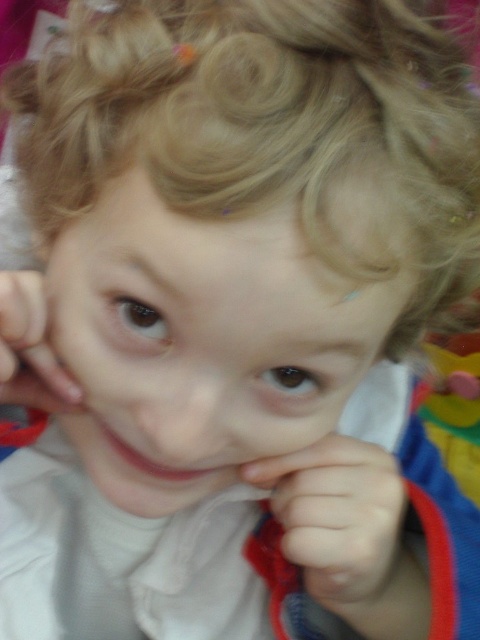
Question: Does smooth skin hand at center have a smaller size compared to smooth skin hand at left?

Choices:
 (A) yes
 (B) no

Answer: (B)

Question: Which object is farther from the camera taking this photo?

Choices:
 (A) smooth skin hand at left
 (B) smooth skin hand at center

Answer: (B)

Question: Can you confirm if smooth skin hand at center is smaller than smooth skin hand at left?

Choices:
 (A) no
 (B) yes

Answer: (A)

Question: Which of the following is the closest to the observer?

Choices:
 (A) (376, 632)
 (B) (11, 400)

Answer: (B)

Question: Which point is farther to the camera?

Choices:
 (A) smooth skin hand at left
 (B) smooth skin hand at center

Answer: (B)

Question: Where is smooth skin hand at center located in relation to smooth skin hand at left in the image?

Choices:
 (A) right
 (B) left

Answer: (A)